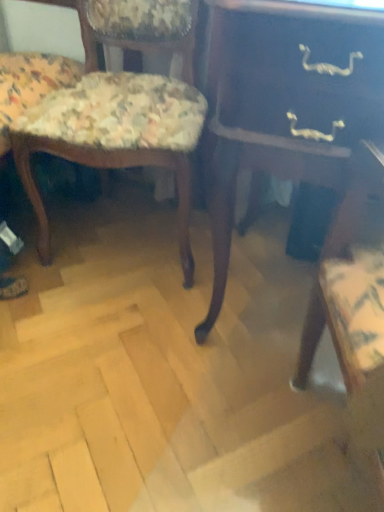
The height and width of the screenshot is (512, 384). What are the coordinates of `free space between floral fabric chair at left, acting as the 1th chair starting from the right, and dark wood table at center` in the screenshot? It's located at (146, 295).